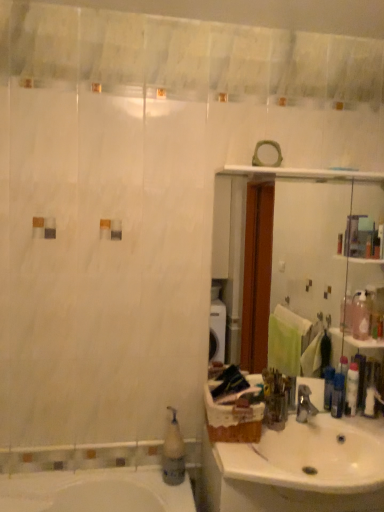
Locate an element on the screen. vacant area that lies to the right of silver metallic faucet at sink right is located at coordinates (332, 435).